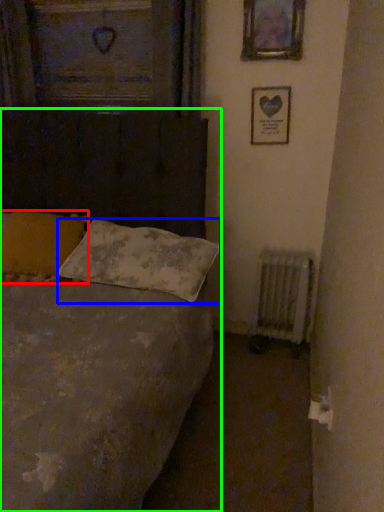
Question: Which is farther away from pillow (highlighted by a red box)? pillow (highlighted by a blue box) or bed (highlighted by a green box)?

Choices:
 (A) pillow
 (B) bed

Answer: (B)